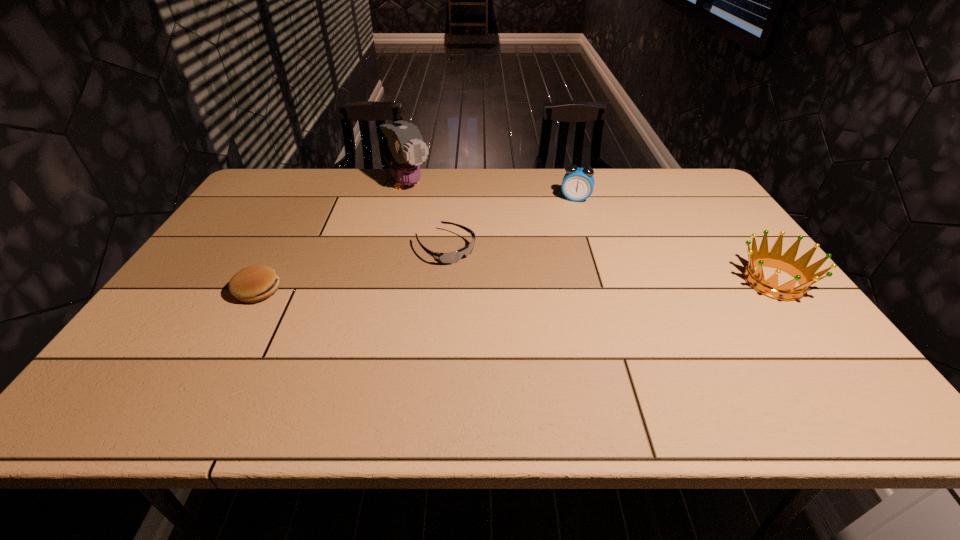
The width and height of the screenshot is (960, 540). I want to click on free space located 0.310m at the beak of the tallest object, so click(471, 244).

Locate an element on the screen. This screenshot has height=540, width=960. vacant area situated at the beak of the tallest object is located at coordinates (460, 234).

Where is `vacant space located 0.100m at the beak of the tallest object`? The height and width of the screenshot is (540, 960). vacant space located 0.100m at the beak of the tallest object is located at coordinates (435, 212).

The image size is (960, 540). Identify the location of free space located on the lenses of the sunglasses. (534, 308).

This screenshot has width=960, height=540. I want to click on free region located on the lenses of the sunglasses, so click(x=481, y=272).

At what (x,y) coordinates should I click in order to perform the action: click on vacant space positioned 0.140m on the lenses of the sunglasses. Please return your answer as a coordinate pair (x, y). Looking at the image, I should click on (502, 286).

At what (x,y) coordinates should I click in order to perform the action: click on free spot located on the face of the alarm clock. Please return your answer as a coordinate pair (x, y). This screenshot has width=960, height=540. Looking at the image, I should click on pos(563,248).

Find the location of `free space located 0.330m on the face of the alarm clock`. free space located 0.330m on the face of the alarm clock is located at coordinates 559,266.

Locate an element on the screen. vacant space located 0.300m on the face of the alarm clock is located at coordinates click(561, 259).

Find the location of a particular element. bird that is at the far edge is located at coordinates (406, 150).